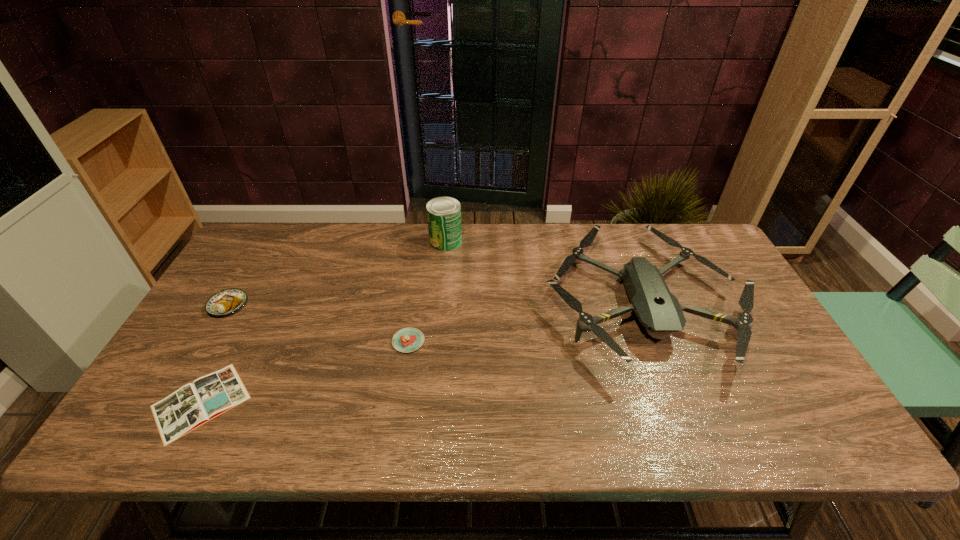
I want to click on vacant space that's between the drone and the shorter pastry, so coord(525,320).

Identify the location of vacant area that lies between the taller pastry and the shortest object. This screenshot has height=540, width=960. (214, 354).

Locate an element on the screen. vacant space that is in between the tallest object and the second shortest object is located at coordinates (427, 291).

Identify the location of free space between the farther pastry and the shortest object. (214, 354).

Find the location of a particular element. This screenshot has width=960, height=540. blank region between the tallest object and the fourth shortest object is located at coordinates (544, 270).

In order to click on free space between the third shortest object and the shortest object in this screenshot , I will do `click(214, 354)`.

I want to click on unoccupied position between the fourth shortest object and the can, so click(544, 270).

Where is `the fourth closest object to the book`? the fourth closest object to the book is located at coordinates (658, 310).

You are a GUI agent. You are given a task and a screenshot of the screen. Output one action in this format:
    pyautogui.click(x=<x>, y=<y>)
    Task: Click on the object that is the fourth closest to the third shortest object
    The width and height of the screenshot is (960, 540).
    Given the screenshot: What is the action you would take?
    pyautogui.click(x=658, y=310)

Locate an element on the screen. vacant region that satisfies the following two spatial constraints: 1. on the front side of the farther pastry; 2. on the left side of the book is located at coordinates (171, 402).